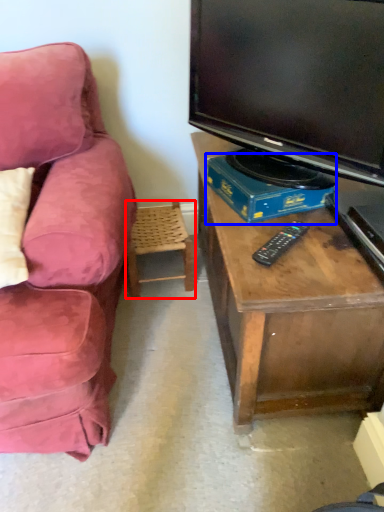
Question: Which point is further to the camera, chair (highlighted by a red box) or book (highlighted by a blue box)?

Choices:
 (A) chair
 (B) book

Answer: (A)